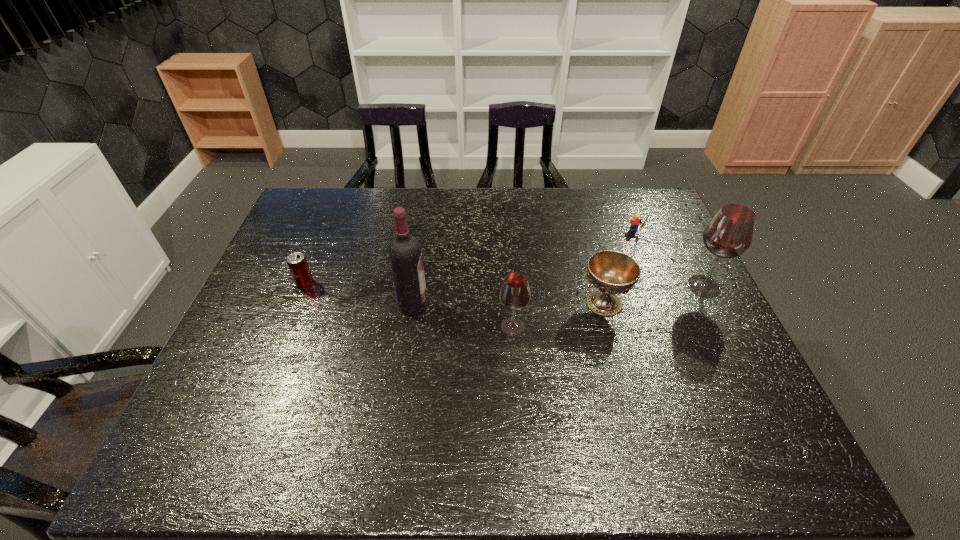
Locate an element on the screen. free space between the farther wineglass and the chalice is located at coordinates (654, 294).

What are the coordinates of `vacant region between the farthest object and the wine bottle` in the screenshot? It's located at (524, 269).

Image resolution: width=960 pixels, height=540 pixels. Find the location of `free space between the beer can and the fourth object from left to right`. free space between the beer can and the fourth object from left to right is located at coordinates (455, 293).

Locate an element on the screen. Image resolution: width=960 pixels, height=540 pixels. free area in between the wine bottle and the rightmost object is located at coordinates (559, 295).

Identify the location of object that is the fourth closest to the Lego. (405, 253).

Locate which object ranks second in proximity to the second object from left to right. Please provide its 2D coordinates. Your answer should be formatted as a tuple, i.e. [(x, y)], where the tuple contains the x and y coordinates of a point satisfying the conditions above.

[(297, 263)]

Where is `free point that satisfies the following two spatial constraints: 1. on the front side of the second tallest object; 2. on the label of the tallest object`? This screenshot has height=540, width=960. free point that satisfies the following two spatial constraints: 1. on the front side of the second tallest object; 2. on the label of the tallest object is located at coordinates (713, 305).

Where is `free location that satisfies the following two spatial constraints: 1. on the label of the nearer wineglass; 2. on the left side of the tallest object`? This screenshot has height=540, width=960. free location that satisfies the following two spatial constraints: 1. on the label of the nearer wineglass; 2. on the left side of the tallest object is located at coordinates (410, 327).

The width and height of the screenshot is (960, 540). I want to click on free space that satisfies the following two spatial constraints: 1. on the front-facing side of the farther wineglass; 2. on the left side of the farthest object, so click(656, 286).

Identify the location of vacant space that satisfies the following two spatial constraints: 1. on the front side of the taller wineglass; 2. on the label of the tallest object. 713,305.